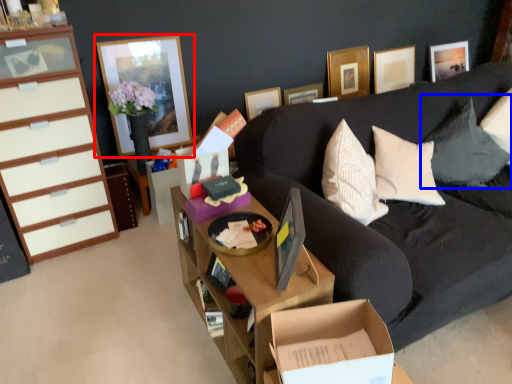
Question: Which point is closer to the camera, picture frame (highlighted by a red box) or pillow (highlighted by a blue box)?

Choices:
 (A) picture frame
 (B) pillow

Answer: (B)